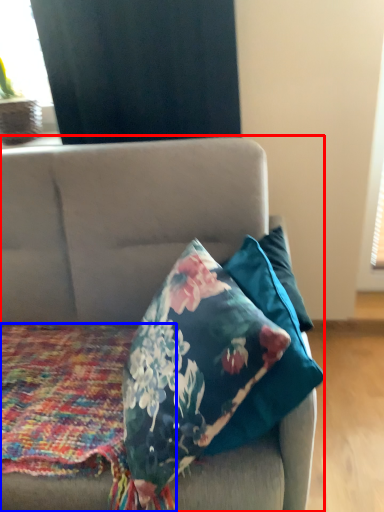
Question: Which object appears farthest to the camera in this image, studio couch (highlighted by a red box) or blanket (highlighted by a blue box)?

Choices:
 (A) studio couch
 (B) blanket

Answer: (B)